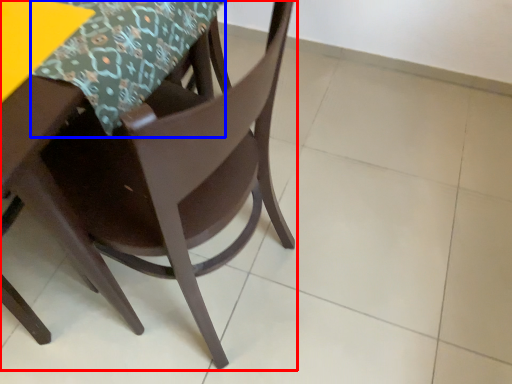
Question: Which of the following is the closest to the observer, chair (highlighted by a red box) or tablecloth (highlighted by a blue box)?

Choices:
 (A) chair
 (B) tablecloth

Answer: (A)